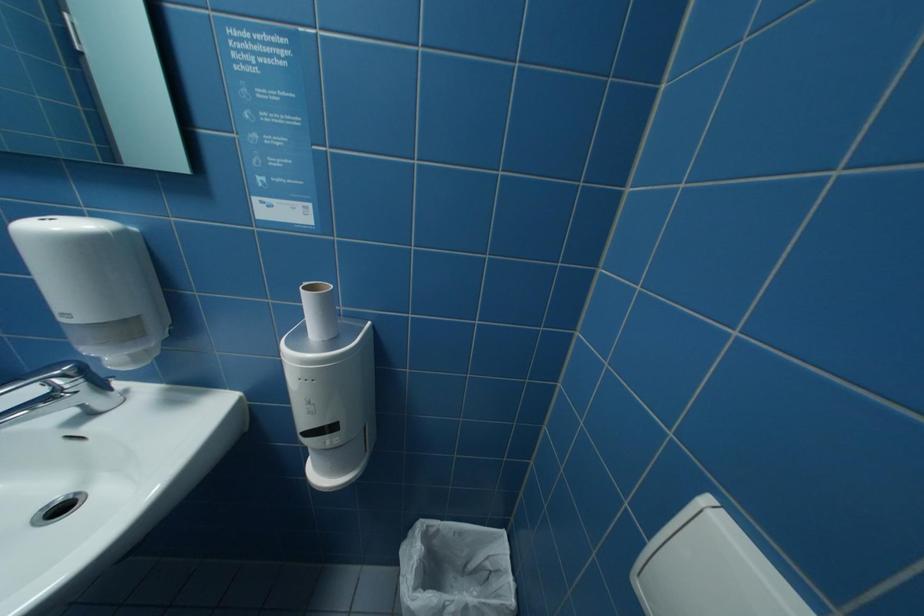
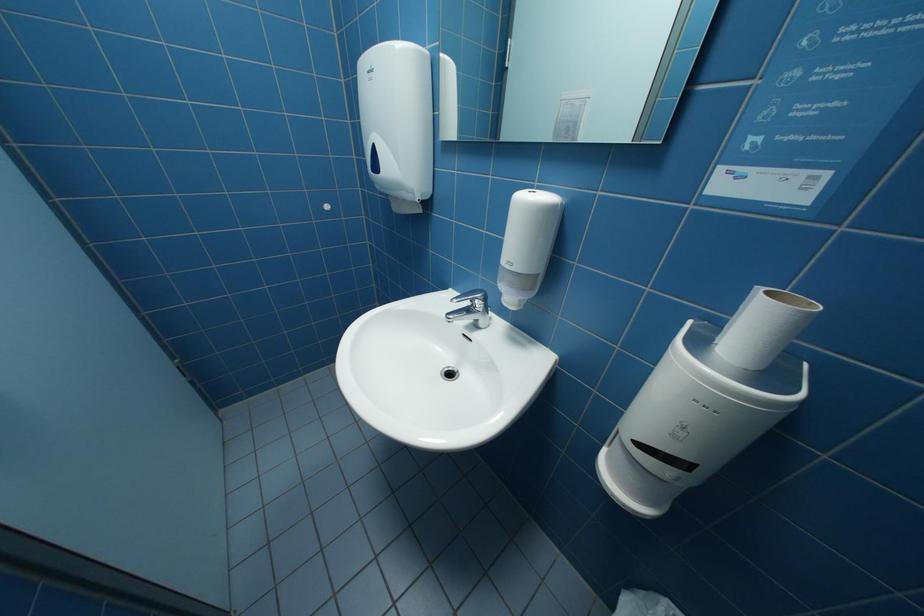
Question: The camera is either moving clockwise (left) or counter-clockwise (right) around the object. The first image is from the beginning of the video and the second image is from the end. Is the camera moving left or right when shooting the video?

Choices:
 (A) Left
 (B) Right

Answer: (B)